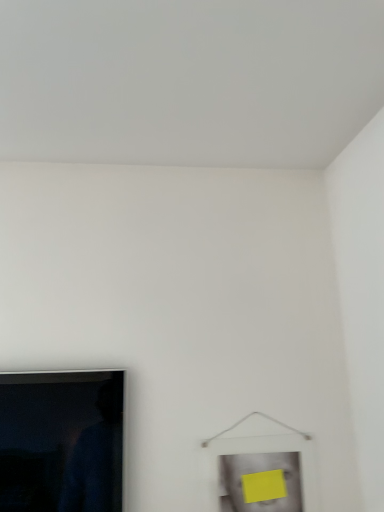
What is the approximate width of matte white picture frame at lower right?

matte white picture frame at lower right is 0.72 inches wide.

Describe the element at coordinates (264, 471) in the screenshot. The image size is (384, 512). I see `matte white picture frame at lower right` at that location.

In order to face matte white picture frame at lower right, should I rotate leftwards or rightwards?

Rotate your view right by about 9.250°.

This screenshot has height=512, width=384. Identify the location of matte white picture frame at lower right. (264, 471).

You are a GUI agent. You are given a task and a screenshot of the screen. Output one action in this format:
    pyautogui.click(x=<x>, y=<y>)
    Task: Click on the matte white picture frame at lower right
    This screenshot has height=512, width=384.
    Given the screenshot: What is the action you would take?
    264,471